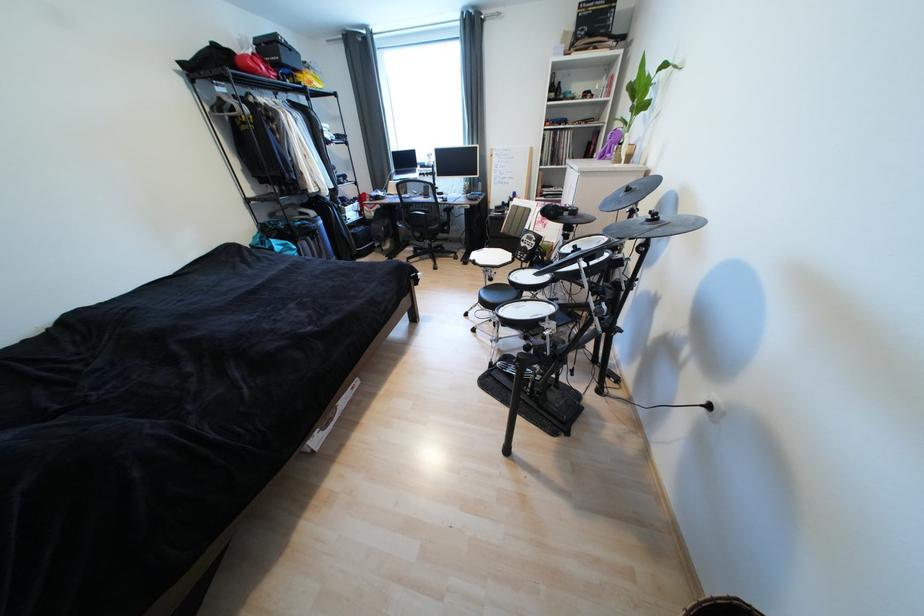
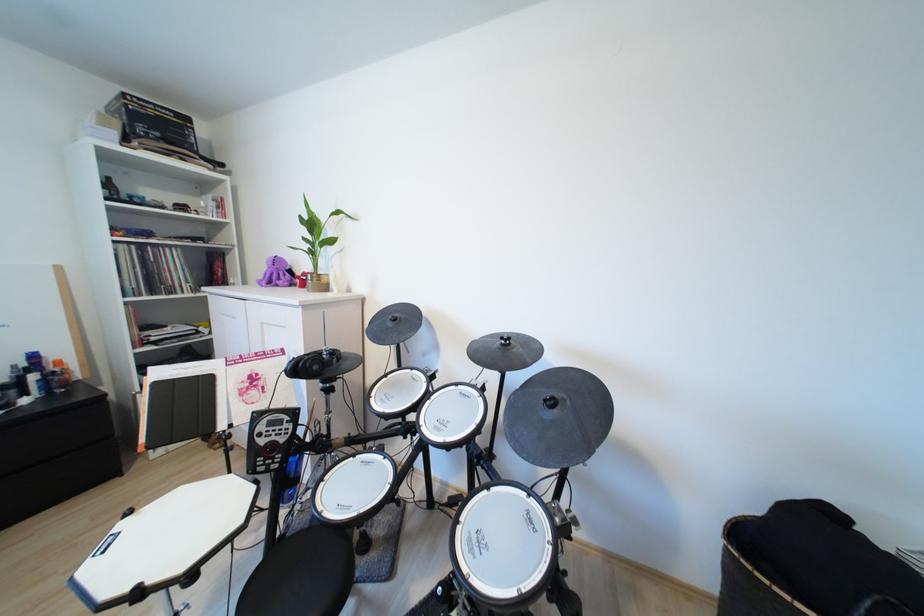
Question: The first image is from the beginning of the video and the second image is from the end. How did the camera likely rotate when shooting the video?

Choices:
 (A) Left
 (B) Right
 (C) Up
 (D) Down

Answer: (B)